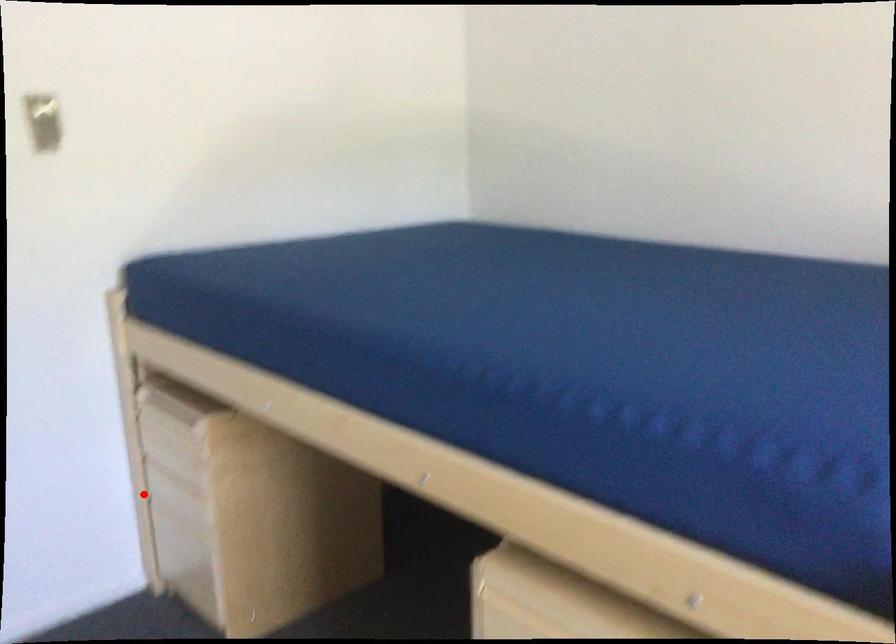
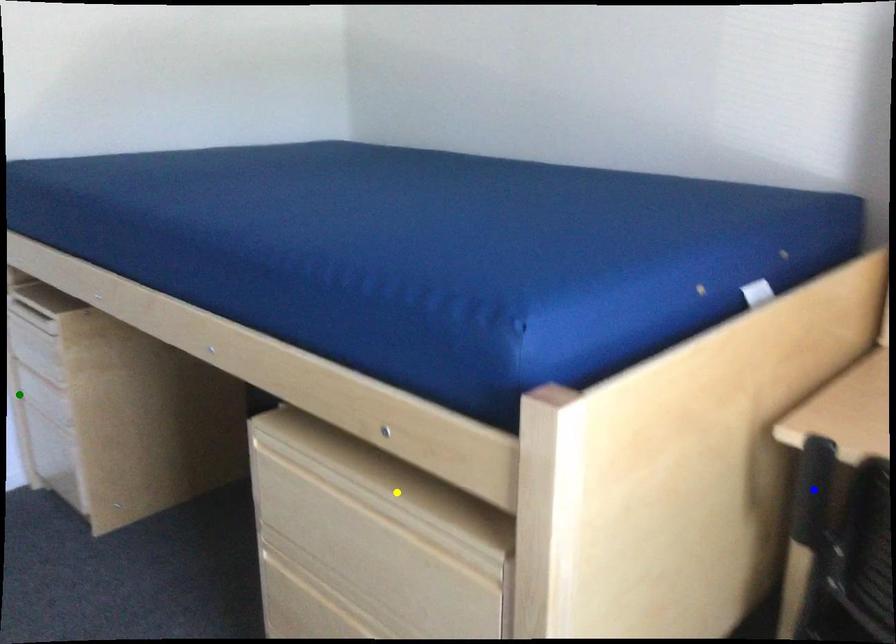
Question: I am providing you with two images of the same scene from different viewpoints. A red point is marked on the first image. You are given multiple points on the second image. Which spot in image 2 lines up with the point in image 1?

Choices:
 (A) green point
 (B) blue point
 (C) yellow point

Answer: (A)